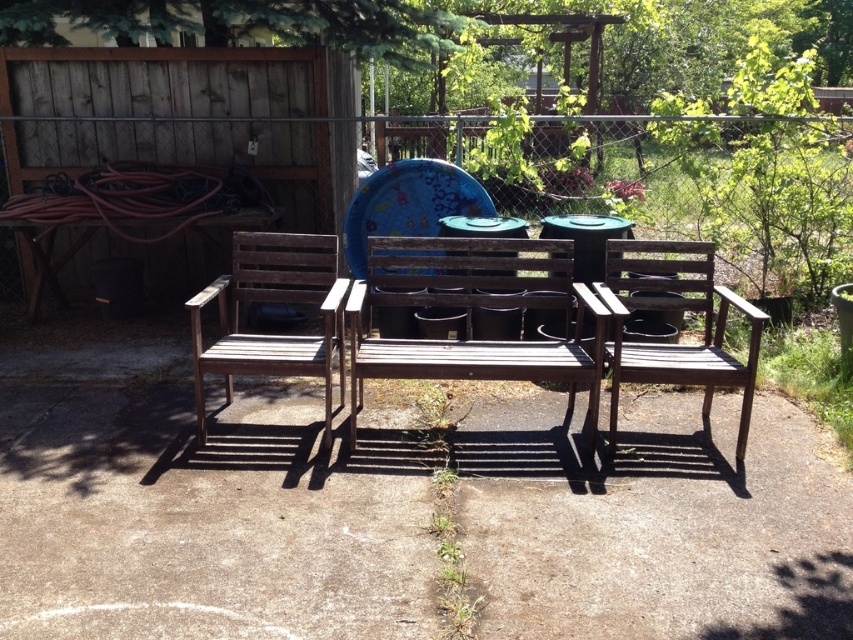
Question: Among these objects, which one is nearest to the camera?

Choices:
 (A) wooden chair at left
 (B) wooden bench at center
 (C) dark brown wood chair at center

Answer: (C)

Question: Does wooden chair at left appear on the left side of dark brown wood chair at center?

Choices:
 (A) no
 (B) yes

Answer: (B)

Question: Does wooden bench at center have a larger size compared to wooden chair at left?

Choices:
 (A) yes
 (B) no

Answer: (A)

Question: Which object is farther from the camera taking this photo?

Choices:
 (A) wooden chair at left
 (B) dark brown wood chair at center

Answer: (A)

Question: Can you confirm if wooden chair at left is bigger than dark brown wood chair at center?

Choices:
 (A) yes
 (B) no

Answer: (B)

Question: Which point is farther to the camera?

Choices:
 (A) (247, 269)
 (B) (680, 307)

Answer: (A)